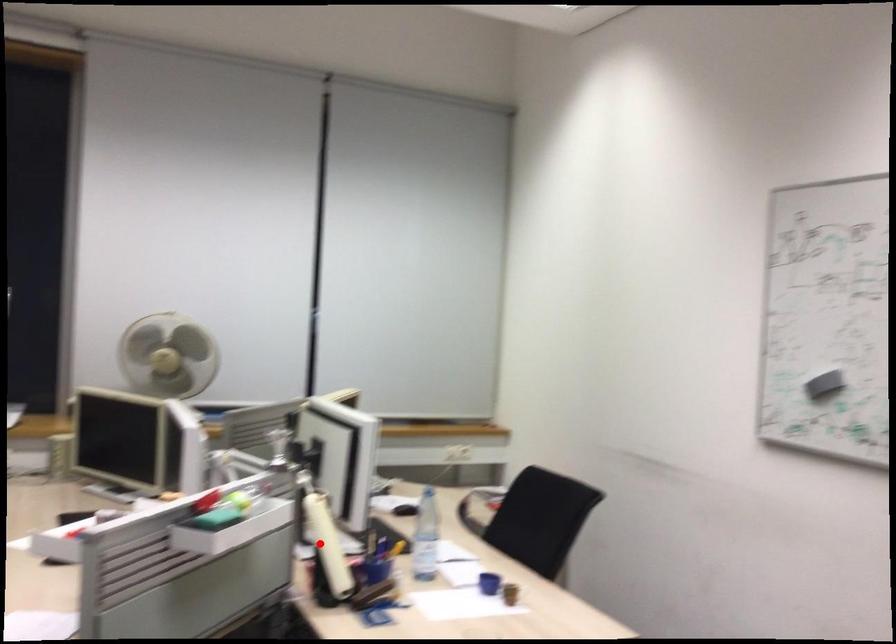
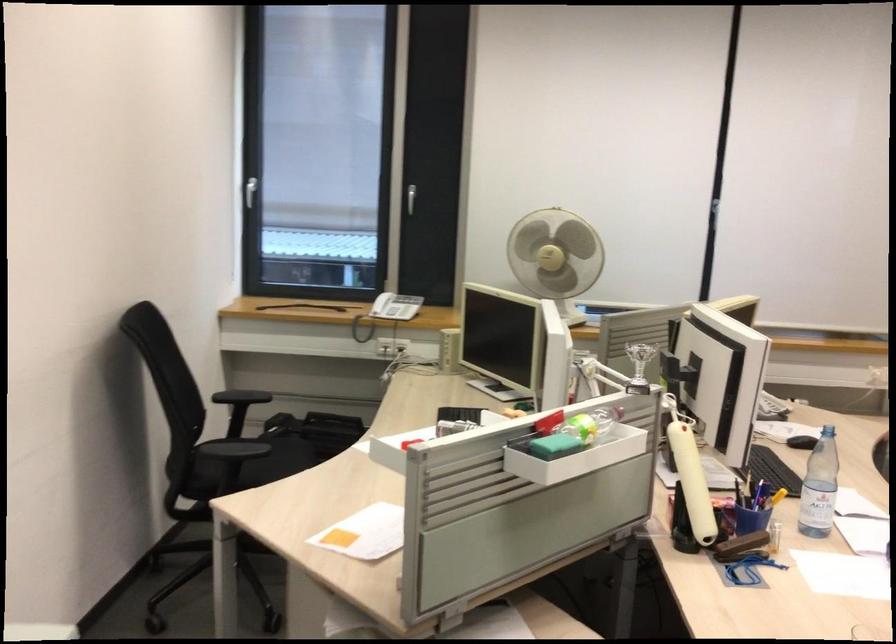
Locate, in the second image, the point that corresponds to the highlighted location in the first image.

(690, 475)